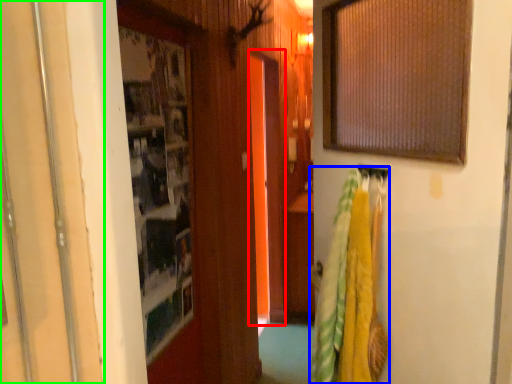
Question: Considering the real-world distances, which object is farthest from screen door (highlighted by a red box)? laundry (highlighted by a blue box) or door (highlighted by a green box)?

Choices:
 (A) laundry
 (B) door

Answer: (B)